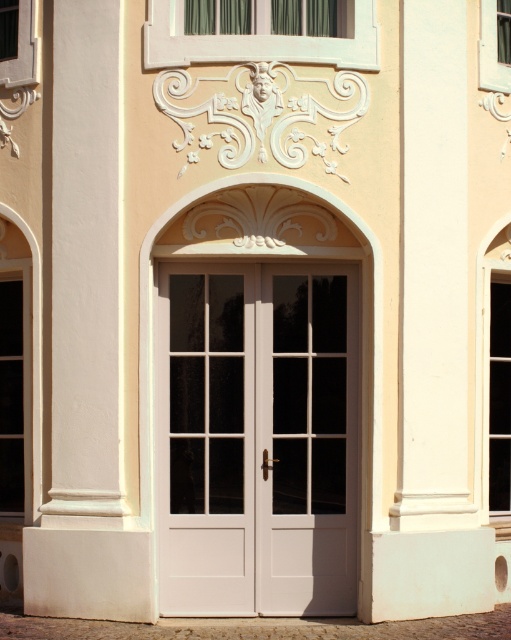
Can you confirm if white wood door at center is positioned below white smooth pillar at right?

Yes.

Does white wood door at center appear over white smooth pillar at right?

Actually, white wood door at center is below white smooth pillar at right.

What are the coordinates of `white wood door at center` in the screenshot? It's located at (258, 440).

Looking at this image, which is more to the right, white wood door at center or white smooth pillar at center?

white wood door at center

Is point (242, 358) in front of point (124, 504)?

No, (242, 358) is further to viewer.

Which is behind, point (210, 416) or point (66, 515)?

The point (210, 416) is more distant.

In order to click on white wood door at center in this screenshot , I will do `click(258, 440)`.

The image size is (511, 640). Identify the location of white smooth pillar at center. (85, 268).

Who is higher up, white smooth pillar at center or white smooth pillar at right?

white smooth pillar at center

Describe the element at coordinates (85, 268) in the screenshot. I see `white smooth pillar at center` at that location.

Where is `white smooth pillar at center`? This screenshot has width=511, height=640. white smooth pillar at center is located at coordinates point(85,268).